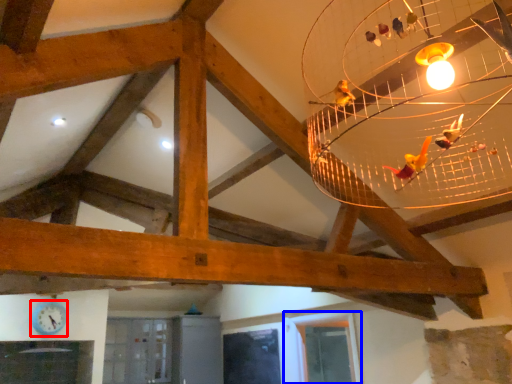
Question: Which object is closer to the camera taking this photo, clock (highlighted by a red box) or window (highlighted by a blue box)?

Choices:
 (A) clock
 (B) window

Answer: (B)